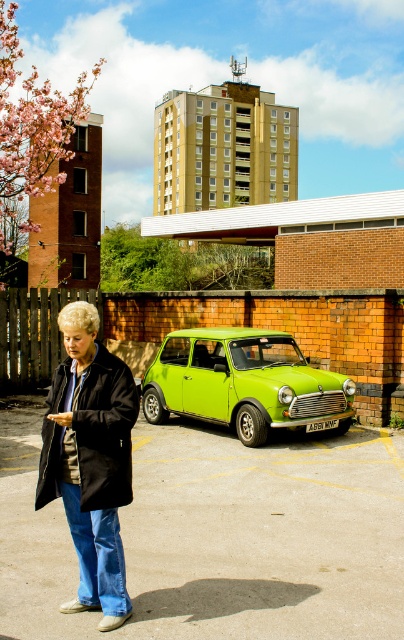
You are standing at the point marked as point (63, 332) in the parking lot. The woman in the scene is 1.6 meters tall. If you want to see the top of her head, how far above the ground should your eyes be positioned?

The point marked as point (63, 332) is 7.07 meters away from the viewer. To see the top of the woman who is 1.6 meters tall, your eyes should be positioned at least 1.6 meters above the ground.

Based on the photo, you are a delivery person trying to deliver a package to the woman wearing the matte black coat at center. The package is too large to carry while walking around the lime green metallic car at center. Can you place the package on the ground near the coat without blocking the car?

The matte black coat at center has a lesser width compared to the lime green metallic car at center, so there is enough space to place the package near the coat without blocking the car.

You are a delivery person who needs to place a package on the ground between the matte black coat at center and the lime green metallic car at center. Can you fit the package there?

The matte black coat at center is positioned over the lime green metallic car at center, so there is no space between them to place the package.